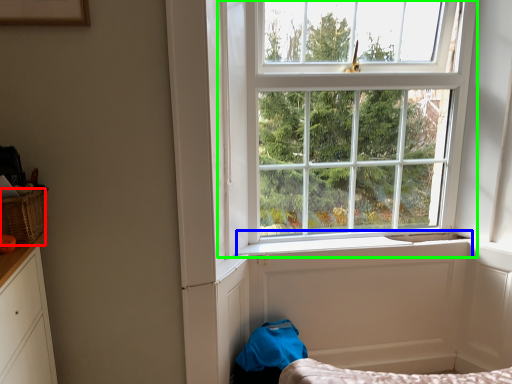
Question: Based on their relative distances, which object is farther from basket (highlighted by a red box)? Choose from window sill (highlighted by a blue box) and window (highlighted by a green box).

Choices:
 (A) window sill
 (B) window

Answer: (B)